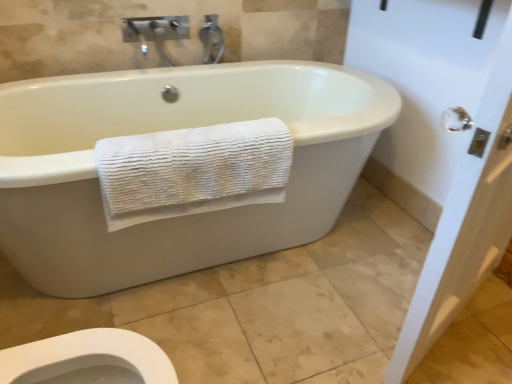
This screenshot has width=512, height=384. What do you see at coordinates (193, 170) in the screenshot? I see `white textured towel at lower left` at bounding box center [193, 170].

The height and width of the screenshot is (384, 512). Find the location of `white textured towel at lower left`. white textured towel at lower left is located at coordinates (193, 170).

What is the approximate width of white textured towel at lower left?

white textured towel at lower left is 20.61 centimeters wide.

In order to face white glossy door handle at upper right, should I rotate leftwards or rightwards?

Turn right by 29.922 degrees to look at white glossy door handle at upper right.

Describe the element at coordinates (442, 145) in the screenshot. I see `white glossy door handle at upper right` at that location.

This screenshot has width=512, height=384. In order to click on white glossy door handle at upper right in this screenshot , I will do `click(442, 145)`.

Locate an element on the screen. The image size is (512, 384). white textured towel at lower left is located at coordinates (193, 170).

Consider the image. Is white textured towel at lower left to the right of white glossy door handle at upper right from the viewer's perspective?

No.

Which object is further away from the camera taking this photo, white textured towel at lower left or white glossy door handle at upper right?

white textured towel at lower left is more distant.

Considering the points (242, 180) and (403, 117), which point is in front, point (242, 180) or point (403, 117)?

The point (242, 180) is closer.

From the image's perspective, is white textured towel at lower left on white glossy door handle at upper right?

Indeed, from the image's perspective, white textured towel at lower left is shown above white glossy door handle at upper right.

Based on the photo, from a real-world perspective, who is located higher, white textured towel at lower left or white glossy door handle at upper right?

white glossy door handle at upper right is physically above.

Does white textured towel at lower left have a lesser width compared to white glossy door handle at upper right?

In fact, white textured towel at lower left might be wider than white glossy door handle at upper right.

Consider the image. Between white textured towel at lower left and white glossy door handle at upper right, which one has less height?

With less height is white textured towel at lower left.

Does white textured towel at lower left have a larger size compared to white glossy door handle at upper right?

Incorrect, white textured towel at lower left is not larger than white glossy door handle at upper right.

Does white textured towel at lower left contain white glossy door handle at upper right?

No, white glossy door handle at upper right is not a part of white textured towel at lower left.

Are white textured towel at lower left and white glossy door handle at upper right located far from each other?

white textured towel at lower left is far away from white glossy door handle at upper right.

Is white textured towel at lower left oriented away from white glossy door handle at upper right?

No, white textured towel at lower left is not facing away from white glossy door handle at upper right.

I want to click on screen door above the white textured towel at lower left (from a real-world perspective), so click(442, 145).

Looking at this image, considering the relative positions of white glossy door handle at upper right and white textured towel at lower left in the image provided, is white glossy door handle at upper right to the right of white textured towel at lower left from the viewer's perspective?

Yes, white glossy door handle at upper right is to the right of white textured towel at lower left.

Considering the relative positions of white glossy door handle at upper right and white textured towel at lower left in the image provided, is white glossy door handle at upper right behind white textured towel at lower left?

No, it is in front of white textured towel at lower left.

Does point (444, 57) appear closer or farther from the camera than point (236, 153)?

Point (444, 57) appears to be farther away from the viewer than point (236, 153).

From the image's perspective, is white glossy door handle at upper right located above white textured towel at lower left?

Actually, white glossy door handle at upper right appears below white textured towel at lower left in the image.

In the scene shown: From a real-world perspective, is white glossy door handle at upper right above or below white textured towel at lower left?

In terms of real-world spatial position, white glossy door handle at upper right is above white textured towel at lower left.

Between white glossy door handle at upper right and white textured towel at lower left, which one has smaller width?

white glossy door handle at upper right is thinner.

Does white glossy door handle at upper right have a greater height compared to white textured towel at lower left?

Correct, white glossy door handle at upper right is much taller as white textured towel at lower left.

Looking at the image, does white glossy door handle at upper right seem bigger or smaller compared to white textured towel at lower left?

white glossy door handle at upper right is bigger than white textured towel at lower left.

Is white glossy door handle at upper right surrounding white textured towel at lower left?

No, white glossy door handle at upper right does not contain white textured towel at lower left.

Are white glossy door handle at upper right and white textured towel at lower left located far from each other?

Yes, white glossy door handle at upper right is far from white textured towel at lower left.

Is white glossy door handle at upper right oriented towards white textured towel at lower left?

No, white glossy door handle at upper right is not oriented towards white textured towel at lower left.

In the scene shown: How many degrees apart are the facing directions of white glossy door handle at upper right and white textured towel at lower left?

The angular difference between white glossy door handle at upper right and white textured towel at lower left is 23.2 degrees.

I want to click on towel above the white glossy door handle at upper right (from the image's perspective), so (x=193, y=170).

Locate an element on the screen. towel that appears above the white glossy door handle at upper right (from the image's perspective) is located at coordinates (193, 170).

The image size is (512, 384). I want to click on towel behind the white glossy door handle at upper right, so click(193, 170).